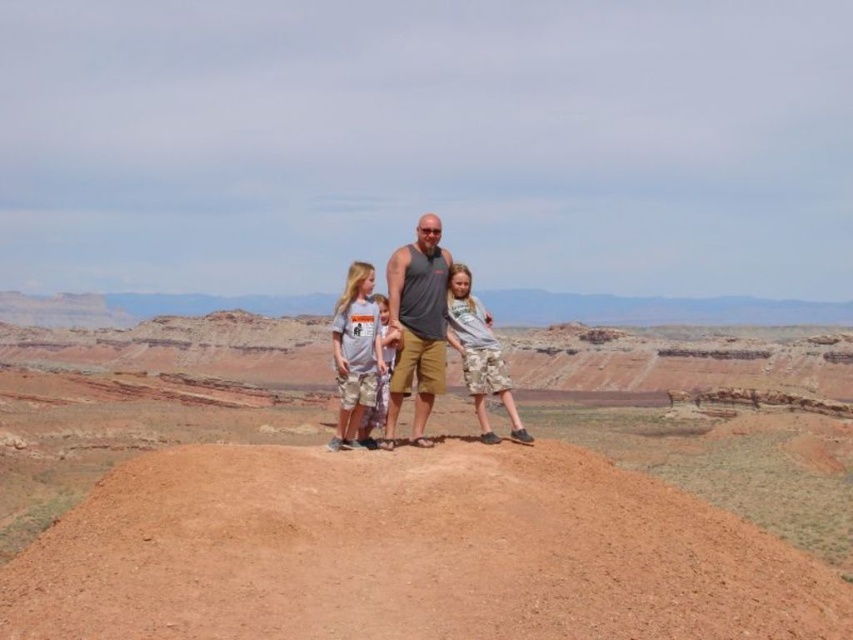
Who is more distant from viewer, [566,499] or [396,403]?

Point [396,403]

Is brown sandy mound at center below gray fabric tank top at center?

Indeed, brown sandy mound at center is positioned under gray fabric tank top at center.

Is point (660, 580) closer to camera compared to point (427, 224)?

Yes, it is.

This screenshot has width=853, height=640. In order to click on brown sandy mound at center in this screenshot , I will do `click(407, 552)`.

Does matte gray tank top at center appear on the left side of camouflage shorts at center?

No, matte gray tank top at center is not to the left of camouflage shorts at center.

Is matte gray tank top at center taller than camouflage shorts at center?

Yes.

The height and width of the screenshot is (640, 853). In order to click on matte gray tank top at center in this screenshot , I will do 418,324.

Who is more distant from viewer, (258,586) or (392,355)?

The point (392,355) is more distant.

Is point (492, 573) positioned behind point (369, 432)?

No, (492, 573) is closer to viewer.

The image size is (853, 640). In order to click on brown sandy mound at center in this screenshot , I will do pos(407,552).